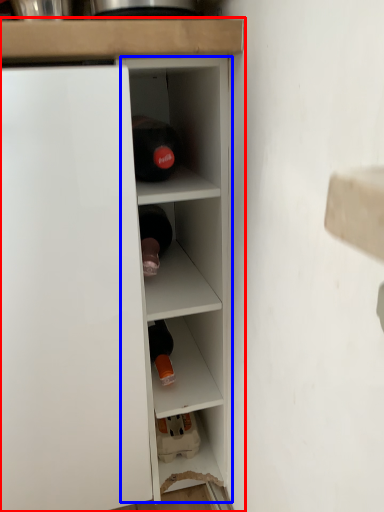
Question: Which point is closer to the camera, cupboard (highlighted by a red box) or cabinet (highlighted by a blue box)?

Choices:
 (A) cupboard
 (B) cabinet

Answer: (A)